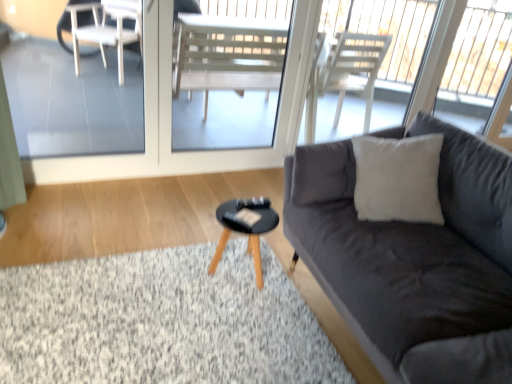
What do you see at coordinates (476, 65) in the screenshot? I see `transparent glass window at upper right` at bounding box center [476, 65].

The width and height of the screenshot is (512, 384). I want to click on black wooden coffee table at center, so click(x=245, y=228).

Locate an element on the screen. dark gray fabric couch at right is located at coordinates (414, 260).

The height and width of the screenshot is (384, 512). I want to click on soft gray carpet at lower left, so click(x=161, y=322).

Looking at this image, which object is thinner, dark gray fabric couch at right or soft gray carpet at lower left?

With smaller width is dark gray fabric couch at right.

Which object is closer to the camera taking this photo, dark gray fabric couch at right or soft gray carpet at lower left?

dark gray fabric couch at right.

Is dark gray fabric couch at right oriented away from soft gray carpet at lower left?

No, dark gray fabric couch at right is not facing the opposite direction of soft gray carpet at lower left.

How many degrees apart are the facing directions of dark gray fabric couch at right and soft gray carpet at lower left?

The facing directions of dark gray fabric couch at right and soft gray carpet at lower left are 180 degrees apart.

Is the position of black wooden coffee table at center more distant than that of transparent glass screen door at upper center?

No, it is in front of transparent glass screen door at upper center.

Is black wooden coffee table at center aimed at transparent glass screen door at upper center?

No.

Is black wooden coffee table at center far away from transparent glass screen door at upper center?

black wooden coffee table at center is actually quite close to transparent glass screen door at upper center.

Is soft gray carpet at lower left at the right side of black wooden coffee table at center?

No, soft gray carpet at lower left is not to the right of black wooden coffee table at center.

Would you say soft gray carpet at lower left contains black wooden coffee table at center?

No.

Based on the photo, is soft gray carpet at lower left next to black wooden coffee table at center and touching it?

They are not placed beside each other.

In the scene shown: From the image's perspective, is dark gray fabric couch at right below black wooden coffee table at center?

Yes.

This screenshot has height=384, width=512. In order to click on coffee table that appears below the dark gray fabric couch at right (from a real-world perspective) in this screenshot , I will do `click(245, 228)`.

In the image, is dark gray fabric couch at right positioned in front of or behind black wooden coffee table at center?

In the image, dark gray fabric couch at right appears in front of black wooden coffee table at center.

Consider the image. From a real-world perspective, is dark gray fabric couch at right over black wooden coffee table at center?

Yes.

Which object is closer to the camera taking this photo, black wooden coffee table at center or dark gray fabric couch at right?

dark gray fabric couch at right is in front.

Identify the location of coffee table below the dark gray fabric couch at right (from a real-world perspective). (245, 228).

Which is closer to the camera, (244, 233) or (490, 203)?

Point (244, 233).

Is black wooden coffee table at center aimed at dark gray fabric couch at right?

No.

Considering the sizes of objects black wooden coffee table at center and transparent glass window at upper right in the image provided, who is taller, black wooden coffee table at center or transparent glass window at upper right?

transparent glass window at upper right is taller.

Is the depth of black wooden coffee table at center less than that of transparent glass window at upper right?

Yes, the depth of black wooden coffee table at center is less than that of transparent glass window at upper right.

From a real-world perspective, is black wooden coffee table at center on transparent glass window at upper right?

Actually, black wooden coffee table at center is physically below transparent glass window at upper right in the real world.

Is black wooden coffee table at center at the left side of transparent glass window at upper right?

Correct, you'll find black wooden coffee table at center to the left of transparent glass window at upper right.

In terms of size, does dark gray fabric couch at right appear bigger or smaller than transparent glass screen door at upper center?

Considering their sizes, dark gray fabric couch at right takes up more space than transparent glass screen door at upper center.

Between dark gray fabric couch at right and transparent glass screen door at upper center, which one has less height?

dark gray fabric couch at right.

Is dark gray fabric couch at right at the right side of transparent glass screen door at upper center?

Correct, you'll find dark gray fabric couch at right to the right of transparent glass screen door at upper center.

Identify the location of flat behind the dark gray fabric couch at right. (161, 322).

Locate an element on the screen. screen door on the left of black wooden coffee table at center is located at coordinates (170, 113).

Looking at the image, which one is located closer to soft gray carpet at lower left, transparent glass window at upper right or black wooden coffee table at center?

black wooden coffee table at center is positioned closer to the anchor soft gray carpet at lower left.

Considering their positions, is dark gray fabric couch at right positioned closer to soft gray carpet at lower left than black wooden coffee table at center?

black wooden coffee table at center is closer to soft gray carpet at lower left.

Considering their positions, is transparent glass screen door at upper center positioned closer to transparent glass window at upper right than black wooden coffee table at center?

The object closer to transparent glass window at upper right is transparent glass screen door at upper center.

Considering their positions, is dark gray fabric couch at right positioned closer to black wooden coffee table at center than transparent glass window at upper right?

Based on the image, dark gray fabric couch at right appears to be nearer to black wooden coffee table at center.

From the image, which object appears to be nearer to transparent glass screen door at upper center, black wooden coffee table at center or dark gray fabric couch at right?

black wooden coffee table at center is positioned closer to the anchor transparent glass screen door at upper center.

From the picture: Based on their spatial positions, is soft gray carpet at lower left or black wooden coffee table at center closer to dark gray fabric couch at right?

Based on the image, black wooden coffee table at center appears to be nearer to dark gray fabric couch at right.

Based on their spatial positions, is black wooden coffee table at center or transparent glass window at upper right closer to transparent glass screen door at upper center?

Among the two, black wooden coffee table at center is located nearer to transparent glass screen door at upper center.

When comparing their distances from black wooden coffee table at center, does soft gray carpet at lower left or transparent glass screen door at upper center seem further?

transparent glass screen door at upper center.

The image size is (512, 384). In order to click on coffee table between soft gray carpet at lower left and transparent glass window at upper right in this screenshot , I will do `click(245, 228)`.

I want to click on coffee table situated between transparent glass screen door at upper center and dark gray fabric couch at right from left to right, so click(x=245, y=228).

Identify the location of flat between transparent glass screen door at upper center and transparent glass window at upper right in the horizontal direction. The width and height of the screenshot is (512, 384). (161, 322).

Find the location of `coffee table between transparent glass screen door at upper center and transparent glass window at upper right in the horizontal direction`. coffee table between transparent glass screen door at upper center and transparent glass window at upper right in the horizontal direction is located at coordinates (245, 228).